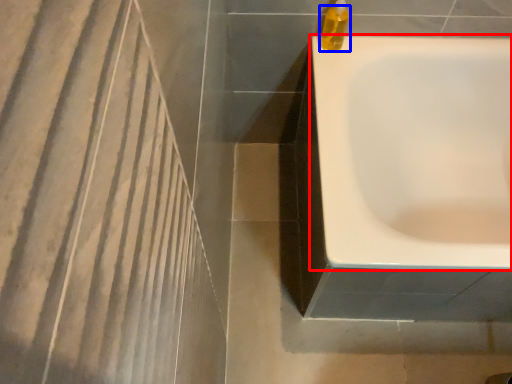
Question: Which point is closer to the camera, bathtub (highlighted by a red box) or liquid (highlighted by a blue box)?

Choices:
 (A) bathtub
 (B) liquid

Answer: (A)